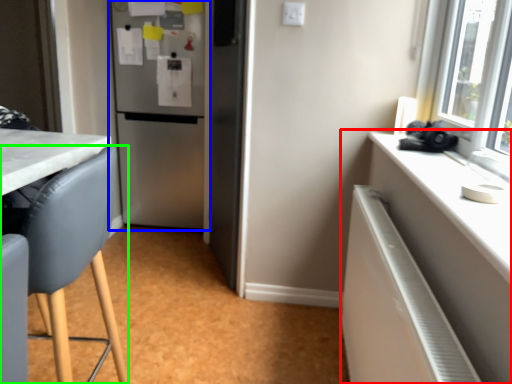
Question: Considering the real-world distances, which object is farthest from cabinetry (highlighted by a red box)? refrigerator (highlighted by a blue box) or chair (highlighted by a green box)?

Choices:
 (A) refrigerator
 (B) chair

Answer: (A)